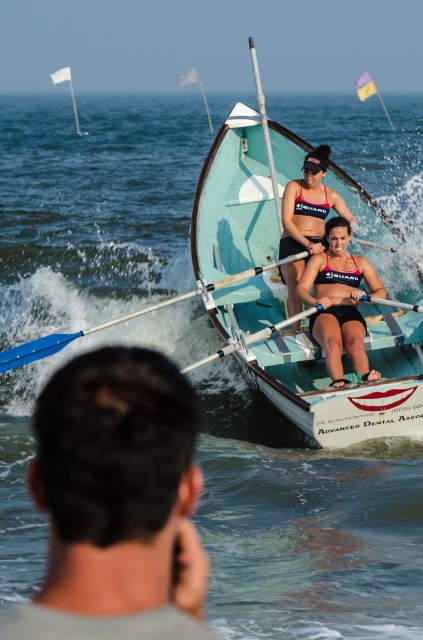
Which is behind, point (216, 253) or point (324, 339)?

Positioned behind is point (216, 253).

Is point (387, 403) farther from viewer compared to point (326, 282)?

That is False.

Which is behind, point (288, 385) or point (349, 305)?

Positioned behind is point (288, 385).

Locate an element on the screen. white glossy canoe at center is located at coordinates (346, 387).

Who is higher up, dark brown hair at lower left or matte black bikini top at center?

matte black bikini top at center is above.

Is dark brown hair at lower left behind matte black bikini top at center?

No, it is in front of matte black bikini top at center.

Does point (90, 365) lie in front of point (320, 209)?

Yes, it is.

I want to click on dark brown hair at lower left, so click(117, 502).

Does dark brown hair at lower left appear under matte black swimsuit at center?

Yes, dark brown hair at lower left is below matte black swimsuit at center.

Image resolution: width=423 pixels, height=640 pixels. Find the location of `dark brown hair at lower left`. dark brown hair at lower left is located at coordinates (117, 502).

You are a GUI agent. You are given a task and a screenshot of the screen. Output one action in this format:
    pyautogui.click(x=<x>, y=<y>)
    Task: Click on the dark brown hair at lower left
    This screenshot has width=423, height=640.
    Given the screenshot: What is the action you would take?
    [x=117, y=502]